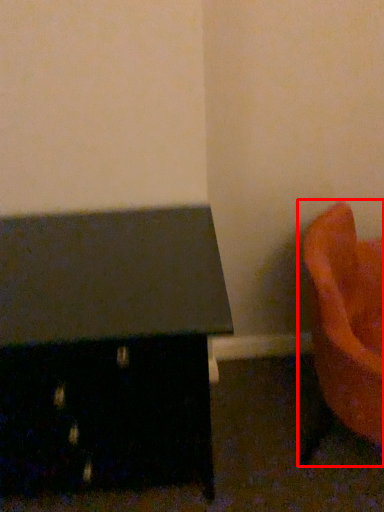
Question: From the image's perspective, considering the relative positions of furniture (annotated by the red box) and furniture in the image provided, where is furniture (annotated by the red box) located with respect to the staircase?

Choices:
 (A) above
 (B) below

Answer: (A)